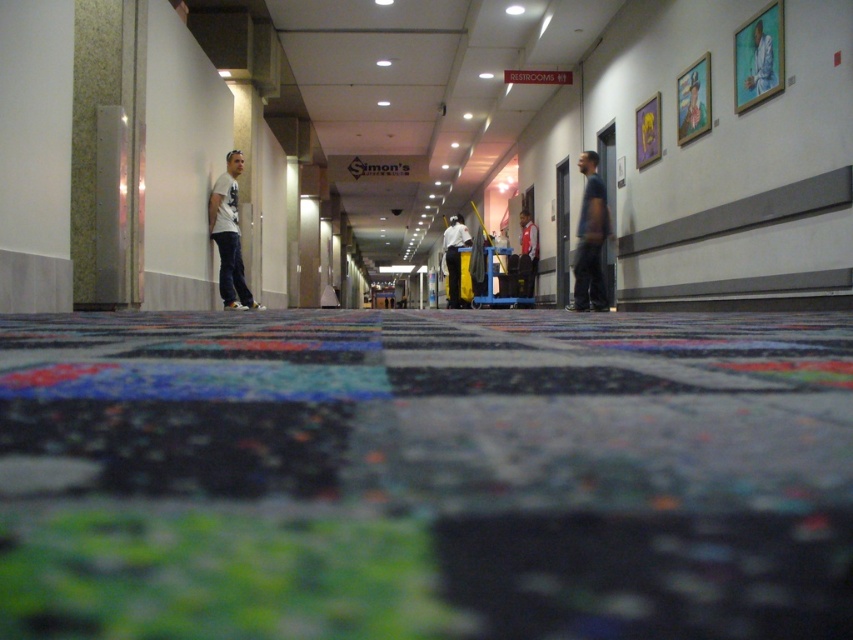
You are a delivery person carrying a box that is 16 feet long. You need to pass through the corridor between the blue fabric shirt at upper right and the person on the left side. Can you fit through the space without tilting the box?

The distance between the blue fabric shirt at upper right and the person on the left side is 15.61 feet, which is shorter than the box length of 16 feet. Therefore, the box cannot fit through the space without tilting.

You are standing at the entrance of the corridor and see the point at coordinates (229, 236). What object is located at that point?

The point at coordinates (229, 236) indicates the white matte t shirt at left.